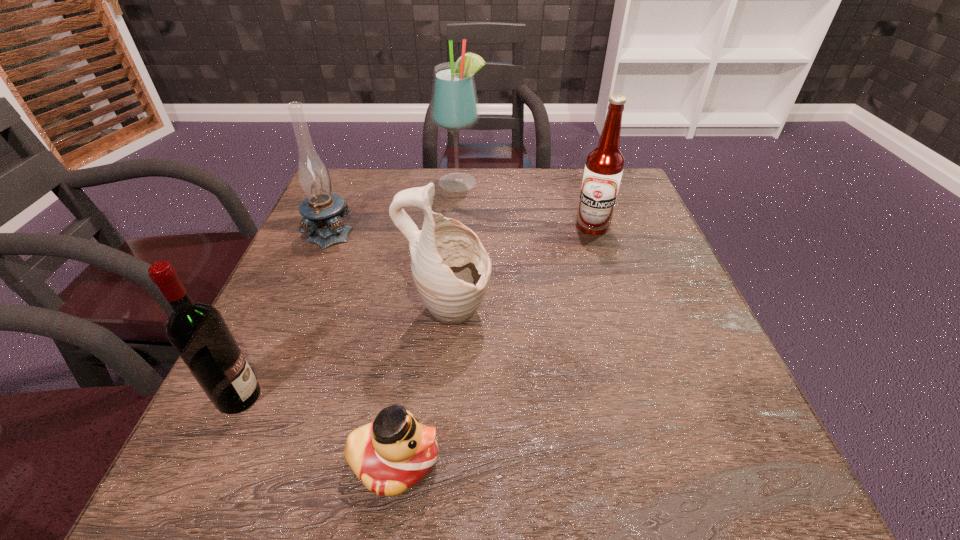
This screenshot has width=960, height=540. I want to click on vacant space that satisfies the following two spatial constraints: 1. on the label side of the rightmost object; 2. on the front and back of the second nearest object, so click(x=647, y=397).

At what (x,y) coordinates should I click in order to perform the action: click on free space that satisfies the following two spatial constraints: 1. on the label side of the rightmost object; 2. at the spout of the pitcher. Please return your answer as a coordinate pair (x, y). Looking at the image, I should click on (621, 315).